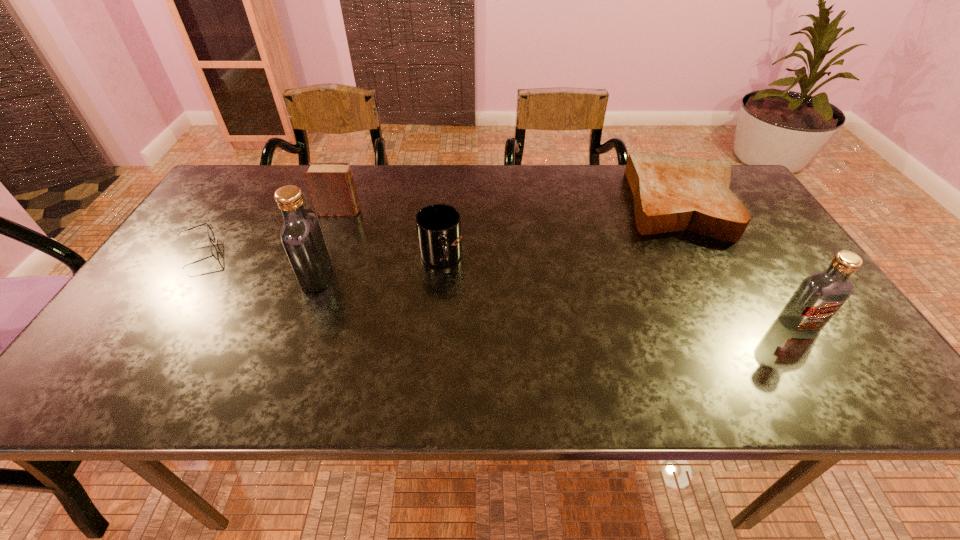
Find the location of `free space between the shortest object and the nearer vodka`. free space between the shortest object and the nearer vodka is located at coordinates (499, 288).

The image size is (960, 540). Find the location of `free area in between the fourth shortest object and the fifth tallest object`. free area in between the fourth shortest object and the fifth tallest object is located at coordinates (511, 207).

Locate an element on the screen. The width and height of the screenshot is (960, 540). empty location between the leftmost object and the fifth shortest object is located at coordinates (499, 288).

Identify the location of unoccupied position between the nearer vodka and the fifth tallest object. 740,264.

The height and width of the screenshot is (540, 960). What are the coordinates of `empty space that is in between the nearest object and the tallest object` in the screenshot? It's located at point(558,301).

Image resolution: width=960 pixels, height=540 pixels. I want to click on free spot between the third object from right to left and the third tallest object, so click(x=391, y=235).

The image size is (960, 540). In order to click on free spot between the fourth object from left to right and the diary in this screenshot , I will do `click(391, 235)`.

Find the location of a particular element. This screenshot has height=540, width=960. empty location between the second shortest object and the diary is located at coordinates (511, 207).

Locate an element on the screen. vacant space in between the nearer vodka and the left vodka is located at coordinates (558, 301).

Point out which object is positioned as the nearest to the shortest object. Please provide its 2D coordinates. Your answer should be formatted as a tuple, i.e. [(x, y)], where the tuple contains the x and y coordinates of a point satisfying the conditions above.

[(331, 185)]